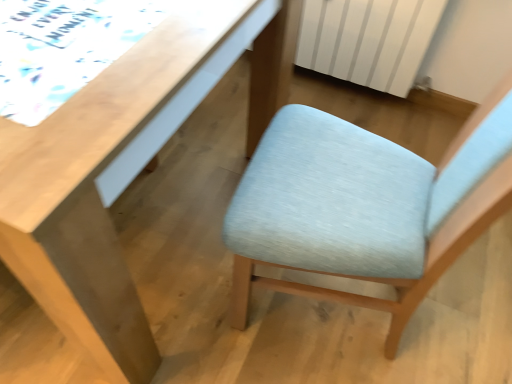
Question: Can you confirm if light wood desk at upper left is taller than light blue fabric chair at center?

Choices:
 (A) yes
 (B) no

Answer: (B)

Question: Is the depth of light wood desk at upper left greater than that of light blue fabric chair at center?

Choices:
 (A) no
 (B) yes

Answer: (B)

Question: Is light wood desk at upper left not inside light blue fabric chair at center?

Choices:
 (A) yes
 (B) no

Answer: (A)

Question: From a real-world perspective, is light wood desk at upper left over light blue fabric chair at center?

Choices:
 (A) no
 (B) yes

Answer: (A)

Question: Is light wood desk at upper left in contact with light blue fabric chair at center?

Choices:
 (A) no
 (B) yes

Answer: (A)

Question: Are light wood desk at upper left and light blue fabric chair at center far apart?

Choices:
 (A) yes
 (B) no

Answer: (B)

Question: Is white striped radiator at upper right not close to light blue fabric chair at center?

Choices:
 (A) yes
 (B) no

Answer: (B)

Question: From a real-world perspective, is white striped radiator at upper right on top of light blue fabric chair at center?

Choices:
 (A) yes
 (B) no

Answer: (B)

Question: Is white striped radiator at upper right located outside light blue fabric chair at center?

Choices:
 (A) yes
 (B) no

Answer: (A)

Question: Considering the relative sizes of white striped radiator at upper right and light blue fabric chair at center in the image provided, is white striped radiator at upper right smaller than light blue fabric chair at center?

Choices:
 (A) yes
 (B) no

Answer: (A)

Question: From a real-world perspective, is white striped radiator at upper right physically below light blue fabric chair at center?

Choices:
 (A) no
 (B) yes

Answer: (B)

Question: Is white striped radiator at upper right bigger than light blue fabric chair at center?

Choices:
 (A) yes
 (B) no

Answer: (B)

Question: Does white striped radiator at upper right have a lesser width compared to light wood desk at upper left?

Choices:
 (A) no
 (B) yes

Answer: (B)